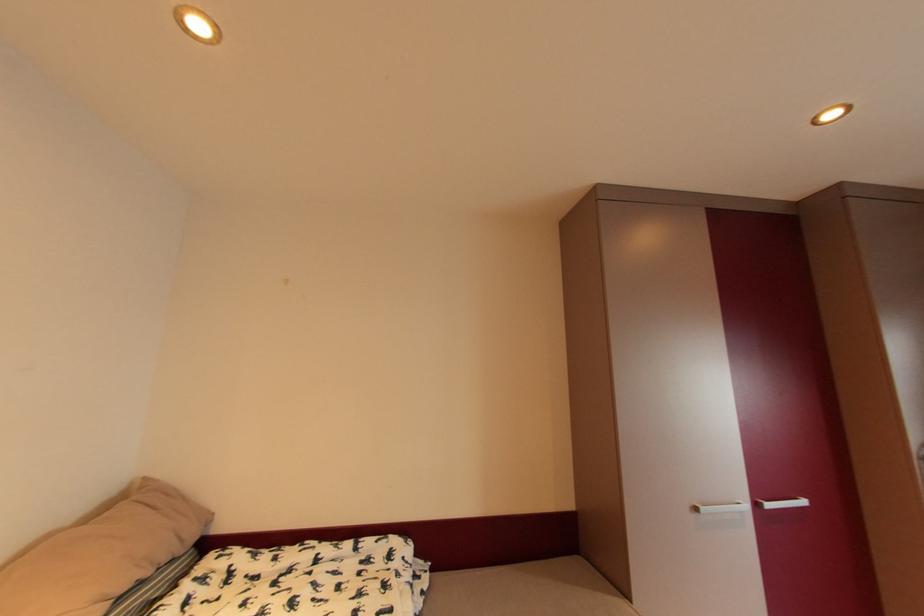
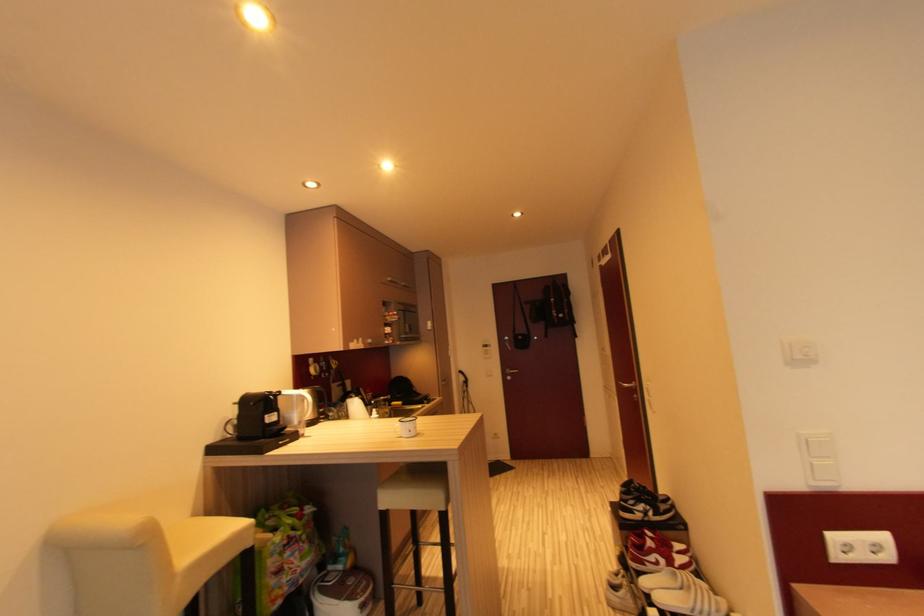
Question: The images are taken continuously from a first-person perspective. In which direction is your viewpoint rotating?

Choices:
 (A) Left
 (B) Right
 (C) Up
 (D) Down

Answer: (A)